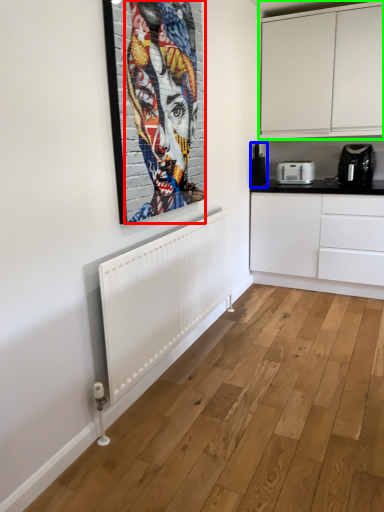
Question: Estimate the real-world distances between objects in this image. Which object is closer to person (highlighted by a red box), coffee machine (highlighted by a blue box) or cabinetry (highlighted by a green box)?

Choices:
 (A) coffee machine
 (B) cabinetry

Answer: (A)